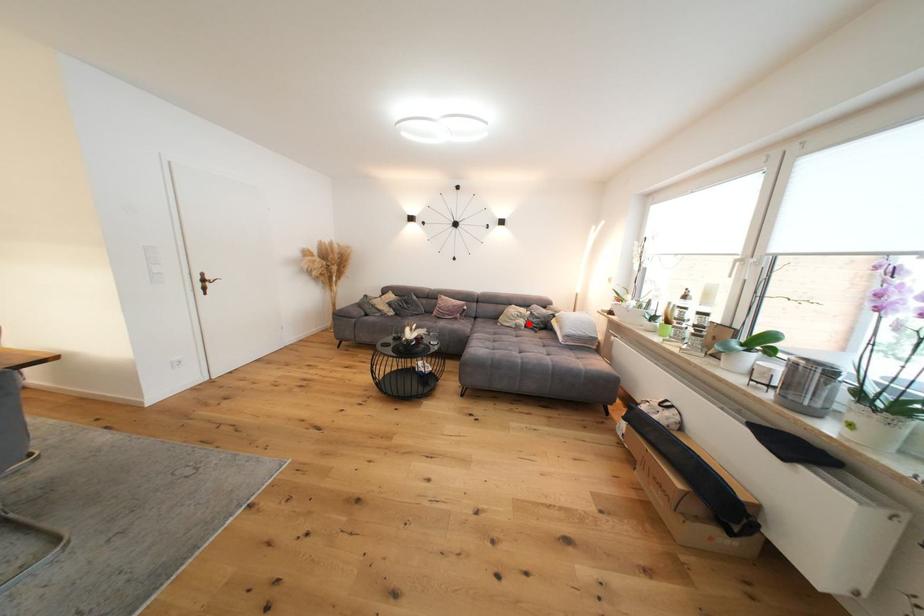
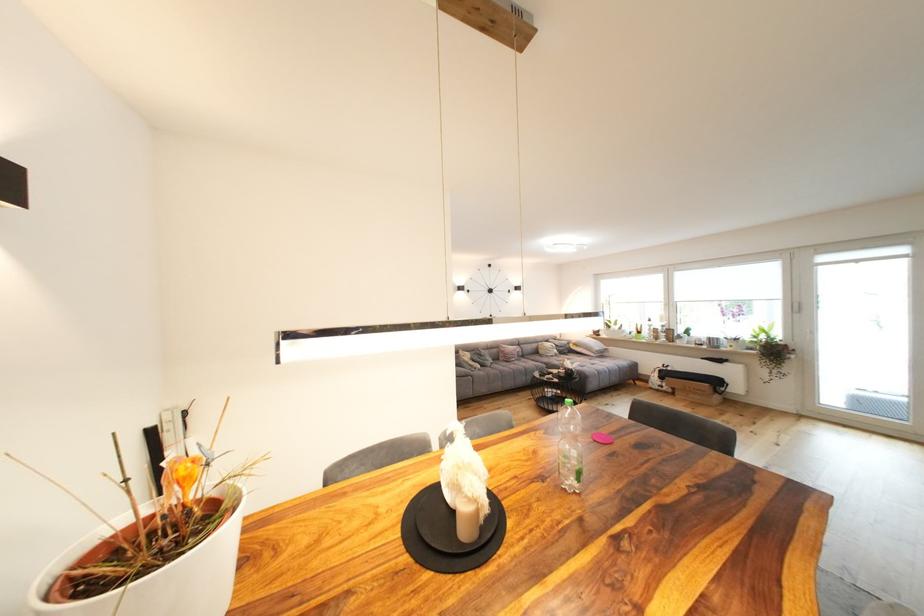
Question: I am providing you with two images of the same scene from different viewpoints. In image1, a red point is highlighted. Considering the same 3D point in image2, which of the following is correct?

Choices:
 (A) It is closer
 (B) It is farther

Answer: (B)